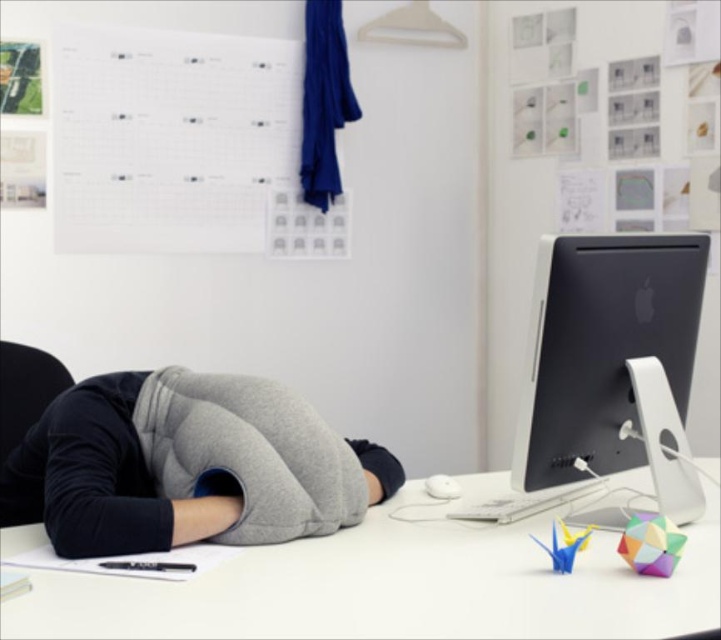
Question: From the image, what is the correct spatial relationship of gray fleece pillow at center in relation to black matte desktop computer at right?

Choices:
 (A) below
 (B) above

Answer: (A)

Question: Among these objects, which one is farthest from the camera?

Choices:
 (A) black matte desktop computer at right
 (B) gray fleece pillow at center
 (C) white paperboard at upper center
 (D) white matte computer desk at center

Answer: (C)

Question: Which object is the closest to the white matte computer desk at center?

Choices:
 (A) gray fleece pillow at center
 (B) black matte desktop computer at right

Answer: (A)

Question: Does gray fleece pillow at center have a lesser width compared to black matte desktop computer at right?

Choices:
 (A) yes
 (B) no

Answer: (B)

Question: Considering the real-world distances, which object is closest to the gray fleece pillow at center?

Choices:
 (A) black matte desktop computer at right
 (B) white paperboard at upper center
 (C) white matte computer desk at center

Answer: (C)

Question: Does white matte computer desk at center have a lesser width compared to gray fleece pillow at center?

Choices:
 (A) no
 (B) yes

Answer: (A)